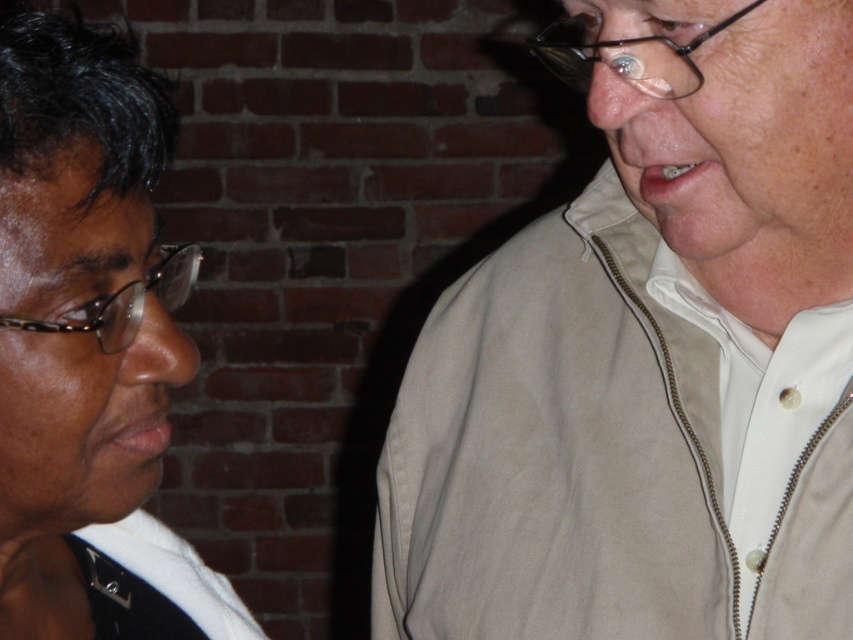
You are an AI analyzing the image. The scene shows two people in front of a brick wall. There is a point marked at coordinates [648,355]. Which object in the image does this point correspond to?

The point at coordinates [648,355] corresponds to the beige zip up jacket at right.